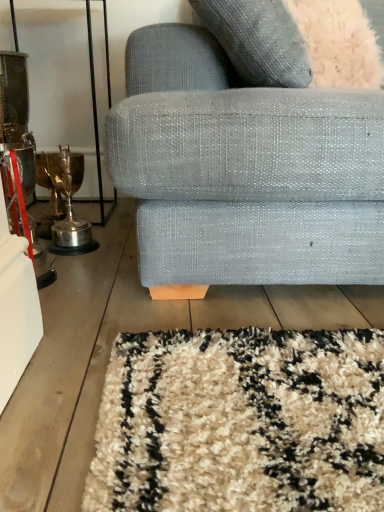
Find the location of a particular element. The height and width of the screenshot is (512, 384). fuzzy gray throw pillow at upper right is located at coordinates (258, 40).

Image resolution: width=384 pixels, height=512 pixels. Describe the element at coordinates (258, 40) in the screenshot. I see `fuzzy gray throw pillow at upper right` at that location.

In order to face fuzzy gray throw pillow at upper right, should I rotate leftwards or rightwards?

To align with it, rotate right about 16.367°.

What do you see at coordinates (244, 172) in the screenshot?
I see `textured gray couch at center` at bounding box center [244, 172].

The width and height of the screenshot is (384, 512). What are the coordinates of `textured gray couch at center` in the screenshot? It's located at (244, 172).

From the picture: Measure the distance between textured gray couch at center and camera.

73.52 centimeters.

What is the approximate width of textured gray couch at center?

The width of textured gray couch at center is 3.61 feet.

I want to click on fuzzy gray throw pillow at upper right, so click(258, 40).

Which object is positioned more to the right, fuzzy gray throw pillow at upper right or textured gray couch at center?

fuzzy gray throw pillow at upper right.

In the image, is fuzzy gray throw pillow at upper right positioned in front of or behind textured gray couch at center?

Clearly, fuzzy gray throw pillow at upper right is behind textured gray couch at center.

Which is further, [261,58] or [204,102]?

The point [261,58] is behind.

From the picture: From the image's perspective, is fuzzy gray throw pillow at upper right located above or below textured gray couch at center?

fuzzy gray throw pillow at upper right is situated higher than textured gray couch at center in the image.

Based on the photo, from a real-world perspective, between fuzzy gray throw pillow at upper right and textured gray couch at center, who is vertically higher?

fuzzy gray throw pillow at upper right.

Is fuzzy gray throw pillow at upper right wider or thinner than textured gray couch at center?

Clearly, fuzzy gray throw pillow at upper right has less width compared to textured gray couch at center.

Between fuzzy gray throw pillow at upper right and textured gray couch at center, which one has more height?

textured gray couch at center is taller.

Considering the sizes of objects fuzzy gray throw pillow at upper right and textured gray couch at center in the image provided, who is smaller, fuzzy gray throw pillow at upper right or textured gray couch at center?

fuzzy gray throw pillow at upper right.

Is fuzzy gray throw pillow at upper right inside the boundaries of textured gray couch at center, or outside?

fuzzy gray throw pillow at upper right lies within the bounds of textured gray couch at center.

Is fuzzy gray throw pillow at upper right touching textured gray couch at center?

There is a gap between fuzzy gray throw pillow at upper right and textured gray couch at center.

Is fuzzy gray throw pillow at upper right aimed at textured gray couch at center?

Yes, fuzzy gray throw pillow at upper right faces towards textured gray couch at center.

Measure the distance between fuzzy gray throw pillow at upper right and textured gray couch at center.

fuzzy gray throw pillow at upper right is 19.57 centimeters from textured gray couch at center.

I want to click on studio couch that is on the left side of fuzzy gray throw pillow at upper right, so click(x=244, y=172).

Between textured gray couch at center and fuzzy gray throw pillow at upper right, which one appears on the left side from the viewer's perspective?

textured gray couch at center is more to the left.

From the picture: Is textured gray couch at center positioned in front of fuzzy gray throw pillow at upper right?

Yes, textured gray couch at center is closer to the viewer.

Considering the points (224, 254) and (202, 4), which point is in front, point (224, 254) or point (202, 4)?

The point (202, 4) is closer to the camera.

From the image's perspective, would you say textured gray couch at center is shown under fuzzy gray throw pillow at upper right?

Yes.

From a real-world perspective, is textured gray couch at center beneath fuzzy gray throw pillow at upper right?

Yes, from a real-world perspective, textured gray couch at center is under fuzzy gray throw pillow at upper right.

Considering the relative sizes of textured gray couch at center and fuzzy gray throw pillow at upper right in the image provided, is textured gray couch at center wider than fuzzy gray throw pillow at upper right?

Yes.

Which of these two, textured gray couch at center or fuzzy gray throw pillow at upper right, stands shorter?

fuzzy gray throw pillow at upper right.

Considering the relative sizes of textured gray couch at center and fuzzy gray throw pillow at upper right in the image provided, is textured gray couch at center bigger than fuzzy gray throw pillow at upper right?

Yes, textured gray couch at center is bigger than fuzzy gray throw pillow at upper right.

Is textured gray couch at center positioned beyond the bounds of fuzzy gray throw pillow at upper right?

textured gray couch at center lies outside fuzzy gray throw pillow at upper right's area.

Is textured gray couch at center far from fuzzy gray throw pillow at upper right?

No, textured gray couch at center is not far away from fuzzy gray throw pillow at upper right.

Is textured gray couch at center oriented towards fuzzy gray throw pillow at upper right?

No, textured gray couch at center is not oriented towards fuzzy gray throw pillow at upper right.

How many degrees apart are the facing directions of textured gray couch at center and fuzzy gray throw pillow at upper right?

textured gray couch at center and fuzzy gray throw pillow at upper right are facing 39.7 degrees away from each other.

The width and height of the screenshot is (384, 512). In order to click on studio couch on the left of fuzzy gray throw pillow at upper right in this screenshot , I will do `click(244, 172)`.

Locate an element on the screen. This screenshot has width=384, height=512. throw pillow located on the right of textured gray couch at center is located at coordinates (258, 40).

Where is `throw pillow behind the textured gray couch at center`? This screenshot has height=512, width=384. throw pillow behind the textured gray couch at center is located at coordinates (258, 40).